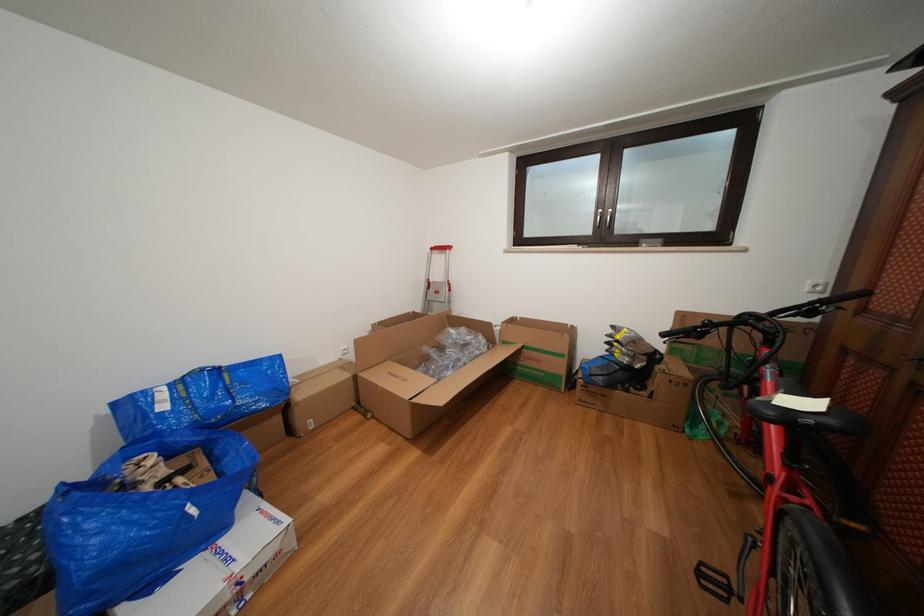
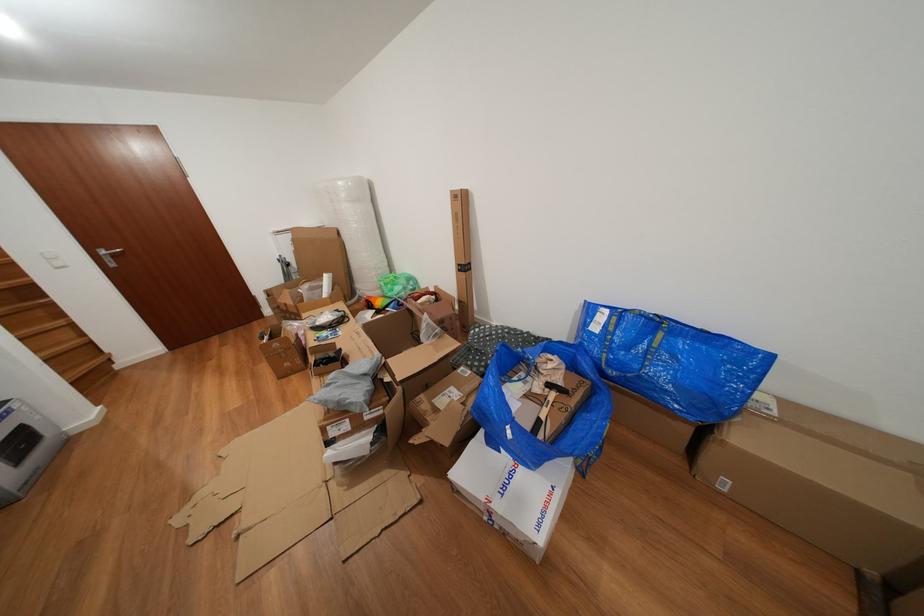
Locate, in the second image, the point that corresponds to (x=225, y=376) in the first image.

(663, 328)